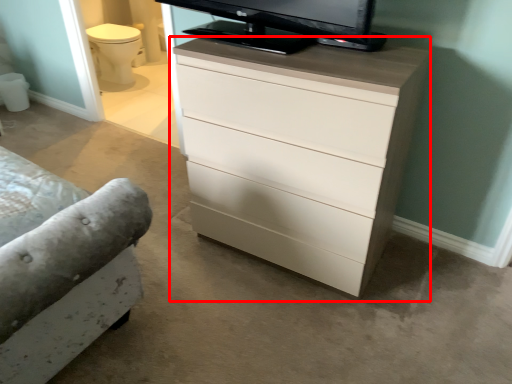
Question: From the image's perspective, where is chest of drawers (annotated by the red box) located relative to drawer?

Choices:
 (A) above
 (B) below

Answer: (A)